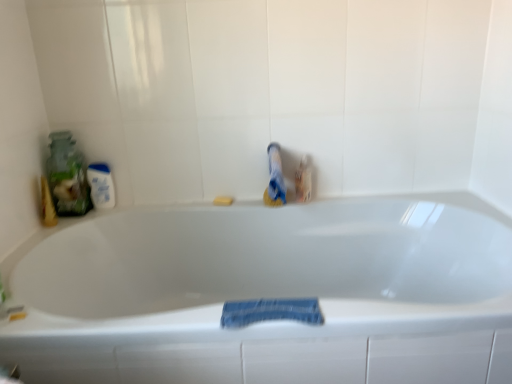
Question: Is point (216, 259) positioned closer to the camera than point (218, 200)?

Choices:
 (A) farther
 (B) closer

Answer: (A)

Question: Considering their positions, is white glossy bathtub at center located in front of or behind yellow sponge at center?

Choices:
 (A) front
 (B) behind

Answer: (A)

Question: Which object is the farthest from the white glossy mouthwash at left?

Choices:
 (A) yellow sponge at center
 (B) white glossy bathtub at center
 (C) faded denim towel at lower center
 (D) translucent glass jar at left

Answer: (C)

Question: Considering the real-world distances, which object is closest to the white glossy mouthwash at left?

Choices:
 (A) white glossy bathtub at center
 (B) faded denim towel at lower center
 (C) yellow sponge at center
 (D) translucent glass jar at left

Answer: (D)